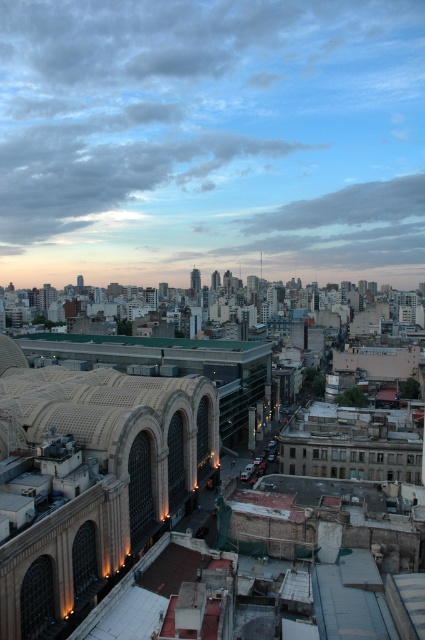
Question: Can you confirm if cloudy sky at upper center is bigger than brick building at center?

Choices:
 (A) yes
 (B) no

Answer: (A)

Question: Which is nearer to the brick building at center?

Choices:
 (A) green matte roof at center
 (B) cloudy sky at upper center

Answer: (A)

Question: Which of the following is the farthest from the observer?

Choices:
 (A) brick building at center
 (B) cloudy sky at upper center

Answer: (B)

Question: Which point is closer to the camera?

Choices:
 (A) (107, 396)
 (B) (337, 188)

Answer: (A)

Question: Is brick building at center smaller than green matte roof at center?

Choices:
 (A) yes
 (B) no

Answer: (B)

Question: Is brick building at center wider than green matte roof at center?

Choices:
 (A) no
 (B) yes

Answer: (B)